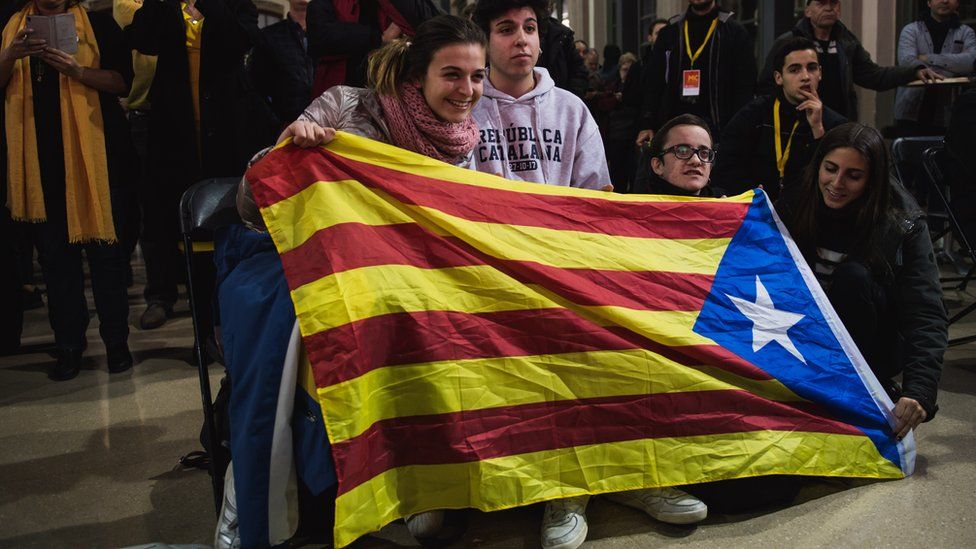
This screenshot has width=976, height=549. I want to click on pen], so click(24, 37).